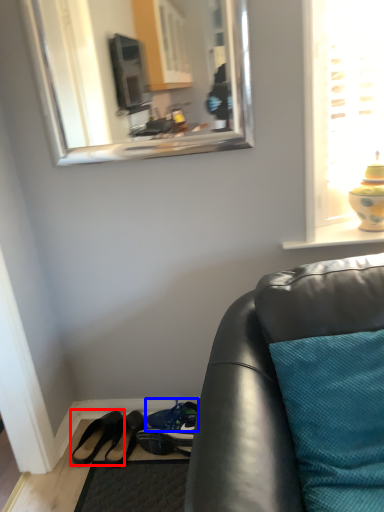
Question: Among these objects, which one is nearest to the camera, footwear (highlighted by a red box) or shoe (highlighted by a blue box)?

Choices:
 (A) footwear
 (B) shoe

Answer: (A)